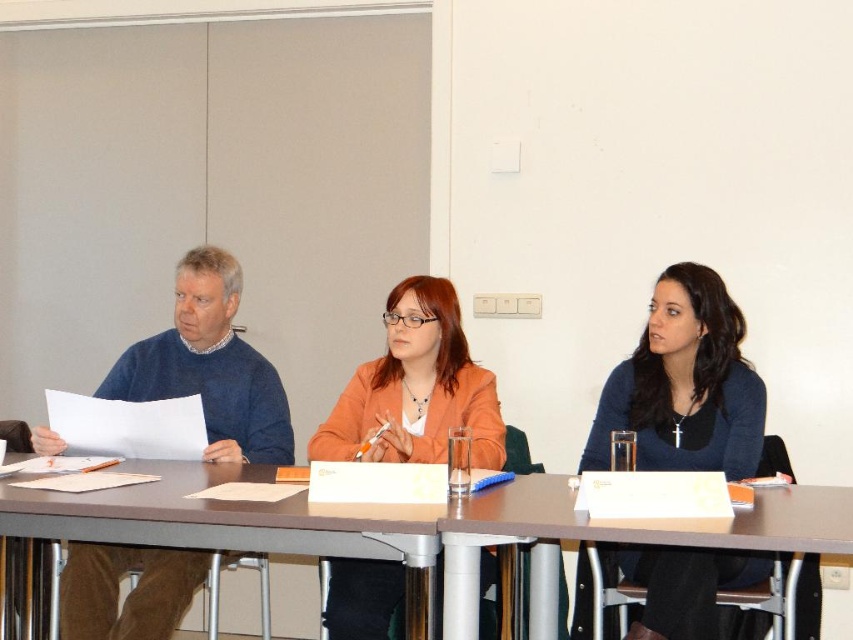
Based on the scene description, what is the 2D coordinate of the smooth wooden table at center?

The smooth wooden table at center is located at the 2D coordinate point of (x=410, y=525).

In the scene shown: You are an event planner organizing a photoshoot in the conference room. You need to position a spotlight on the wall above the dark blue sweater at center and orange matte jacket at center. Which object should the spotlight be placed above to ensure it reaches both?

The spotlight should be placed above the orange matte jacket at center because the dark blue sweater at center is located below it, so positioning the spotlight above the higher object will cover both.